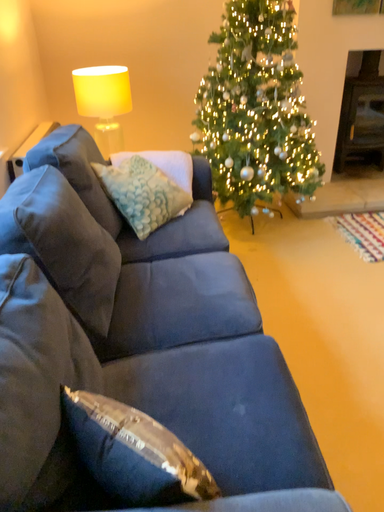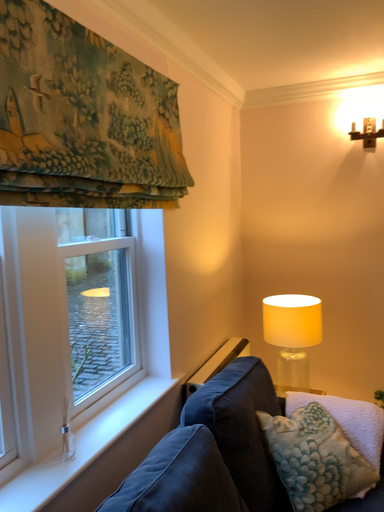
Question: Which way did the camera rotate in the video?

Choices:
 (A) rotated left
 (B) rotated right

Answer: (A)